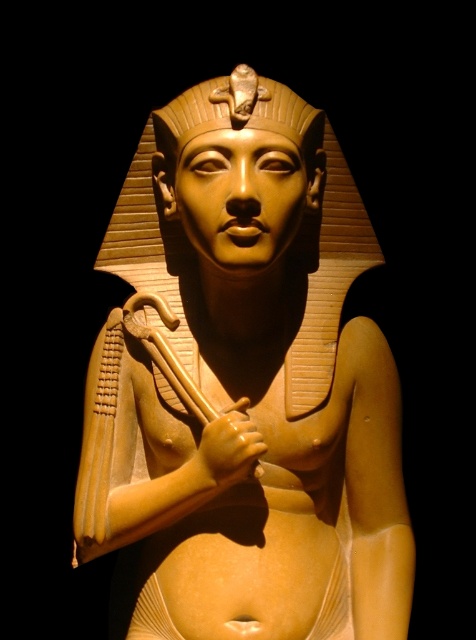
Question: Is matte gold statue at center above matte gold pharaoh head at center?

Choices:
 (A) yes
 (B) no

Answer: (B)

Question: Which of the following is the farthest from the observer?

Choices:
 (A) [x=269, y=173]
 (B) [x=237, y=120]

Answer: (A)

Question: Does matte gold statue at center have a lesser width compared to matte gold pharaoh head at center?

Choices:
 (A) yes
 (B) no

Answer: (B)

Question: Which point appears farthest from the camera in this image?

Choices:
 (A) (188, 93)
 (B) (238, 68)

Answer: (A)

Question: From the image, what is the correct spatial relationship of matte gold statue at center in relation to matte gold pharaoh head at center?

Choices:
 (A) right
 (B) left

Answer: (B)